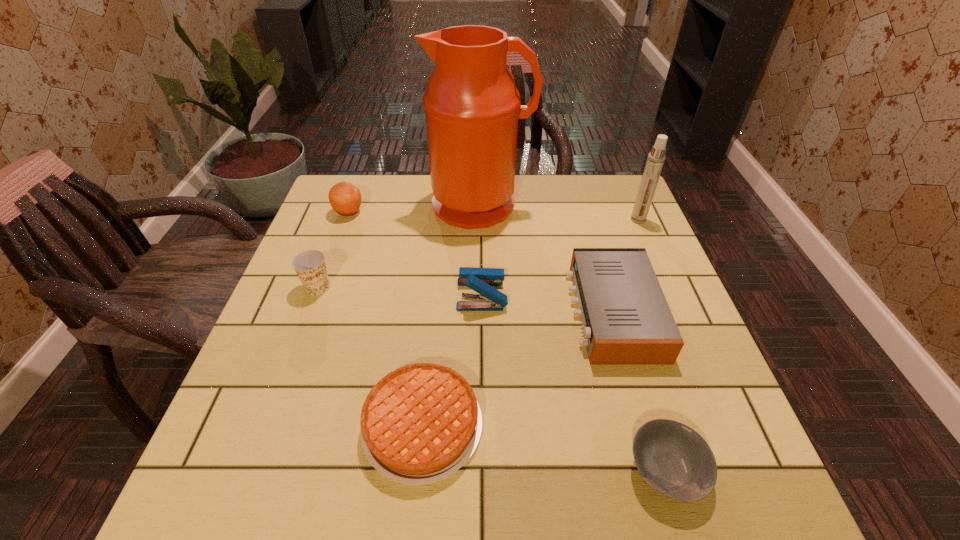
You are a GUI agent. You are given a task and a screenshot of the screen. Output one action in this format:
    pyautogui.click(x=<x>, y=<y>)
    Task: Click on the object at the far right corner
    This screenshot has width=960, height=540.
    Given the screenshot: What is the action you would take?
    pyautogui.click(x=654, y=164)

Locate an element on the screen. The height and width of the screenshot is (540, 960). object located at the near right corner is located at coordinates (675, 460).

Locate an element on the screen. free space at the far edge of the desktop is located at coordinates (520, 201).

At what (x,y) coordinates should I click in order to perform the action: click on vacant space at the near edge of the desktop. Please return your answer as a coordinate pair (x, y). Looking at the image, I should click on 485,463.

Identify the location of vacant position at the left edge of the desktop. (313, 224).

At what (x,y) coordinates should I click in order to perform the action: click on vacant region at the right edge of the desktop. Please return your answer as a coordinate pair (x, y). Image resolution: width=960 pixels, height=540 pixels. Looking at the image, I should click on (686, 312).

In the image, there is a desktop. Where is `vacant space at the far left corner`? vacant space at the far left corner is located at coordinates coord(377,198).

In the image, there is a desktop. Where is `vacant space at the near right corner`? The width and height of the screenshot is (960, 540). vacant space at the near right corner is located at coordinates (727, 495).

The image size is (960, 540). Find the location of `free space between the stapler and the sixth tallest object`. free space between the stapler and the sixth tallest object is located at coordinates (547, 303).

The width and height of the screenshot is (960, 540). I want to click on empty space between the orange and the tallest object, so click(415, 208).